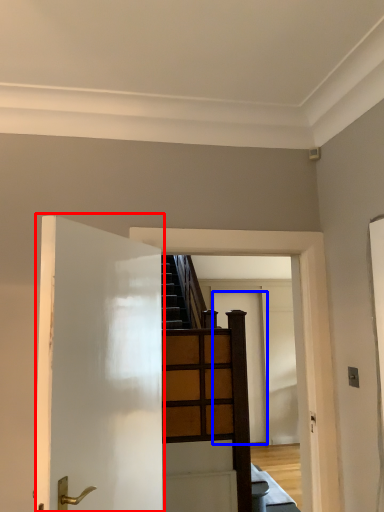
Question: Among these objects, which one is farthest to the camera, door (highlighted by a red box) or door (highlighted by a blue box)?

Choices:
 (A) door
 (B) door

Answer: (B)